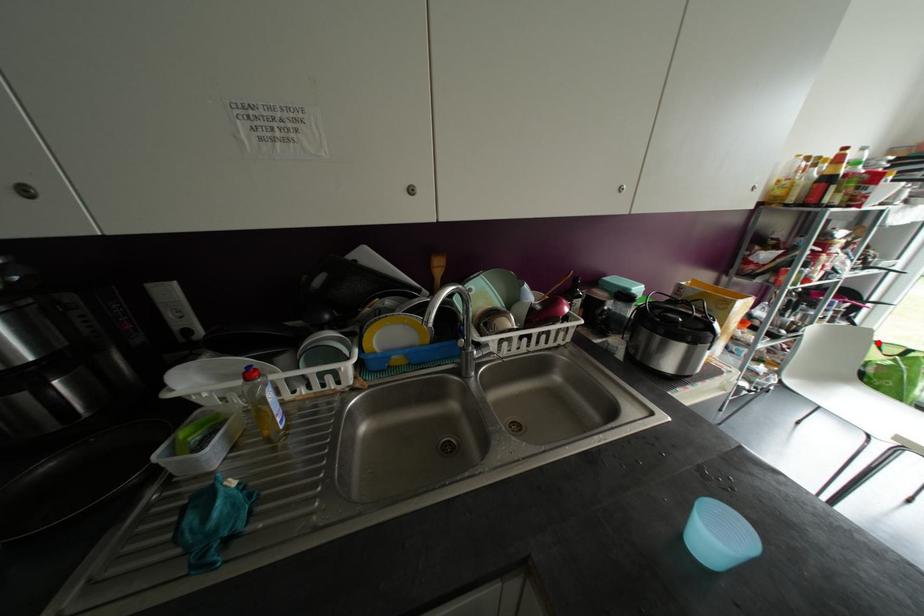
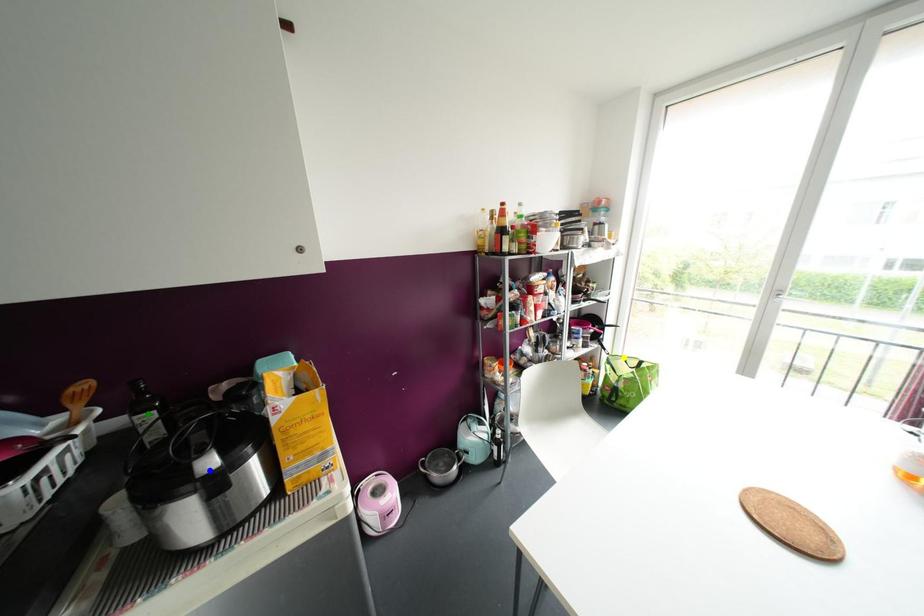
Question: I am providing you with two images of the same scene from different viewpoints. A red point is marked on the first image. You are given multiple points on the second image. Which mark in image 2 goes with the point in image 1?

Choices:
 (A) yellow point
 (B) green point
 (C) blue point

Answer: (A)